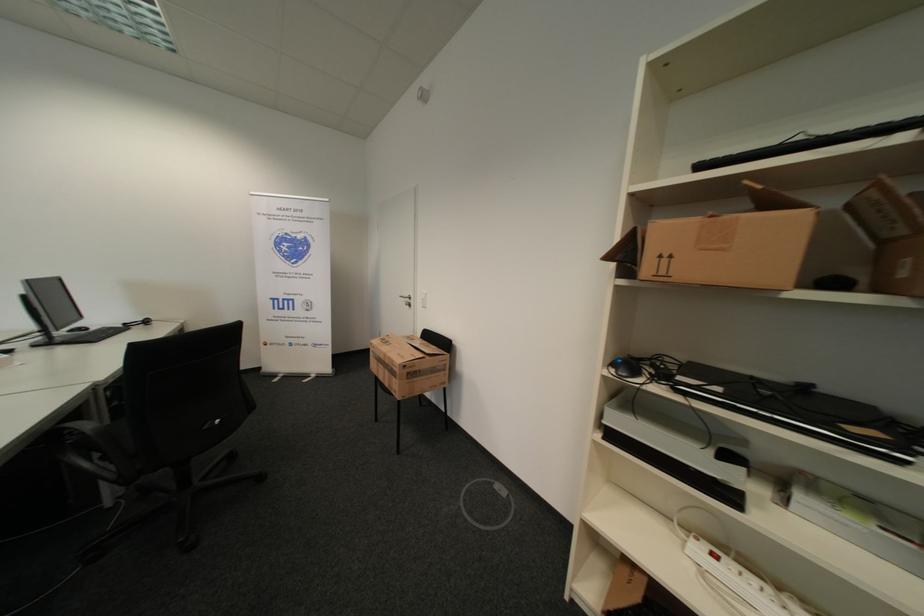
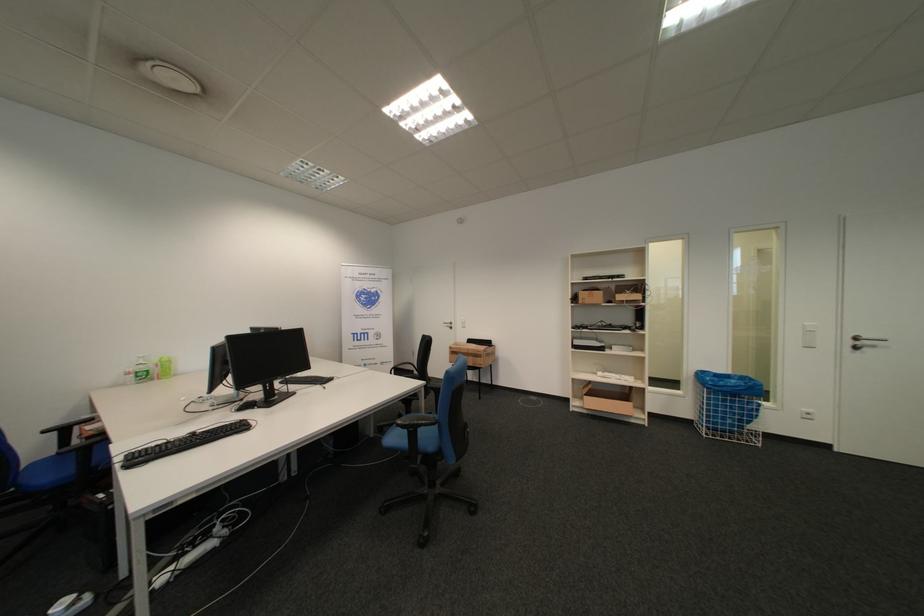
In a continuous first-person perspective shot, in which direction is the camera moving?

The cameraman walked toward left, backward.